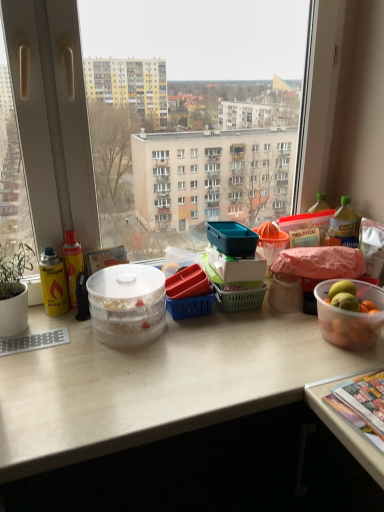
At what (x,y) coordinates should I click in order to perform the action: click on free space to the right of transparent plastic bowl at center, marked as the first bowl in a left-to-right arrangement. Please return your answer as a coordinate pair (x, y). Looking at the image, I should click on (202, 336).